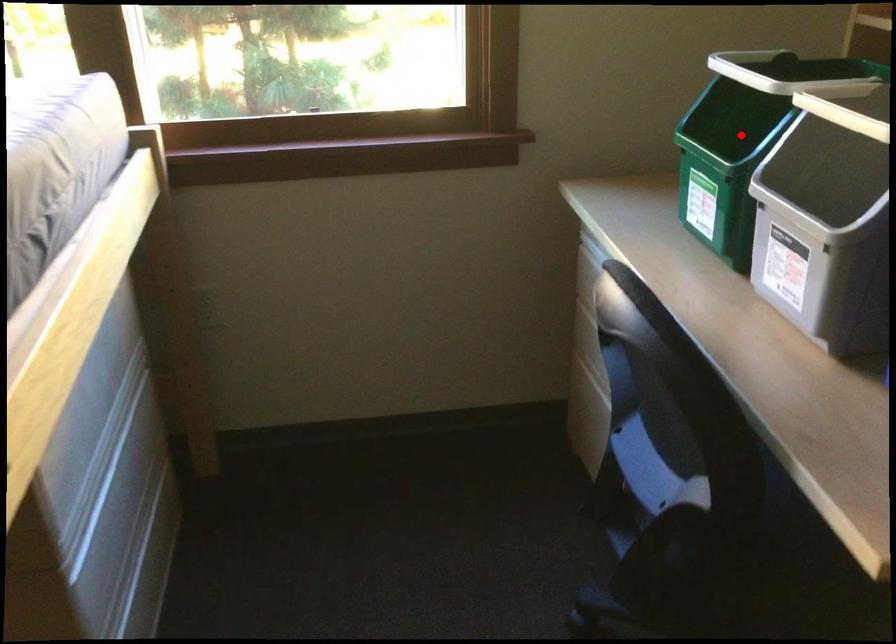
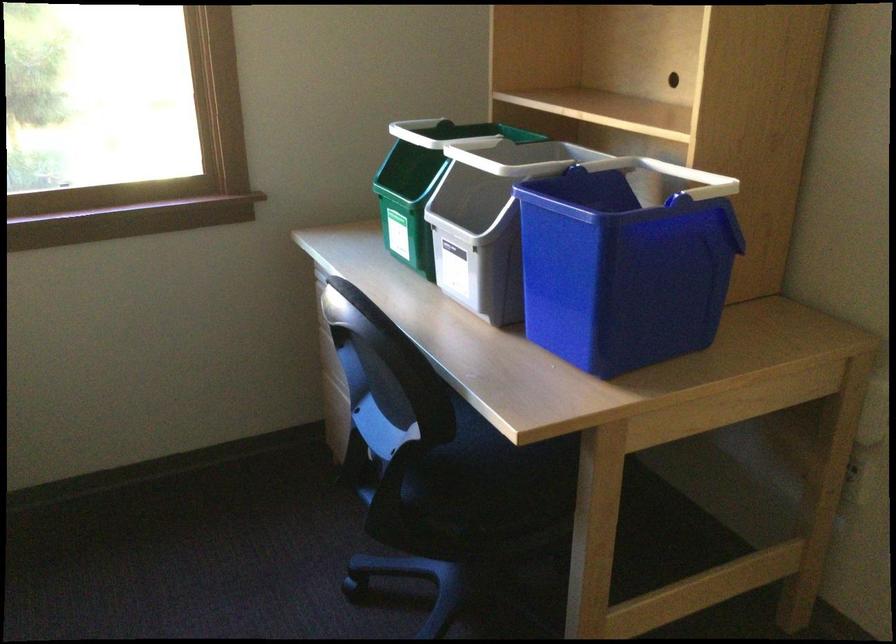
Question: I am providing you with two images of the same scene from different viewpoints. A red point is shown in image1. For the corresponding object point in image2, is it positioned nearer or farther from the camera?

Choices:
 (A) Nearer
 (B) Farther

Answer: (B)